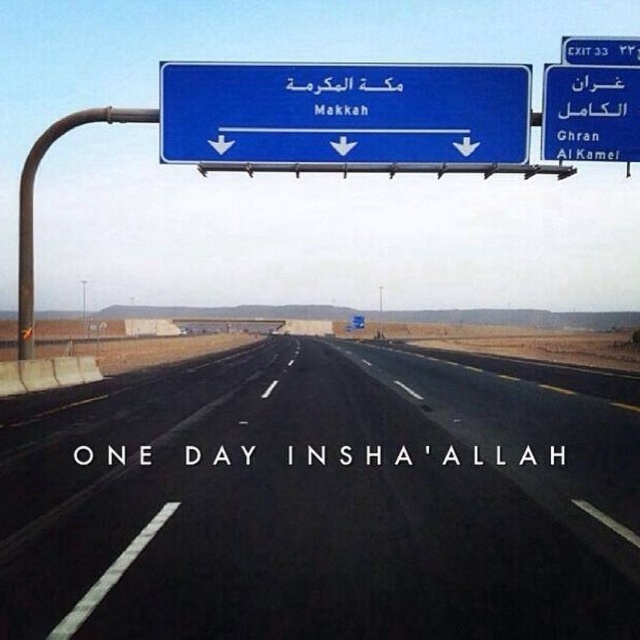
Can you confirm if black asphalt highway at center is positioned above blue plastic exit sign at upper right?

No.

Can you confirm if black asphalt highway at center is positioned below blue plastic exit sign at upper right?

Yes, black asphalt highway at center is below blue plastic exit sign at upper right.

Does point (556, 467) come in front of point (577, 54)?

Yes, point (556, 467) is in front of point (577, 54).

The width and height of the screenshot is (640, 640). I want to click on black asphalt highway at center, so click(317, 502).

Can you confirm if blue metallic sign at center is taller than metallic pole at center?

No, blue metallic sign at center is not taller than metallic pole at center.

Does blue metallic sign at center have a lesser width compared to metallic pole at center?

No.

This screenshot has height=640, width=640. Find the location of `blue metallic sign at center`. blue metallic sign at center is located at coordinates (342, 113).

At what (x,y) coordinates should I click in order to perform the action: click on blue metallic sign at center. Please return your answer as a coordinate pair (x, y). The width and height of the screenshot is (640, 640). Looking at the image, I should click on (342, 113).

Which of these two, blue plastic sign at upper right or metallic pole at center, stands taller?

metallic pole at center

Describe the element at coordinates (589, 113) in the screenshot. I see `blue plastic sign at upper right` at that location.

Who is more distant from viewer, [573,65] or [378,289]?

Positioned behind is point [378,289].

This screenshot has width=640, height=640. I want to click on blue plastic sign at upper right, so click(589, 113).